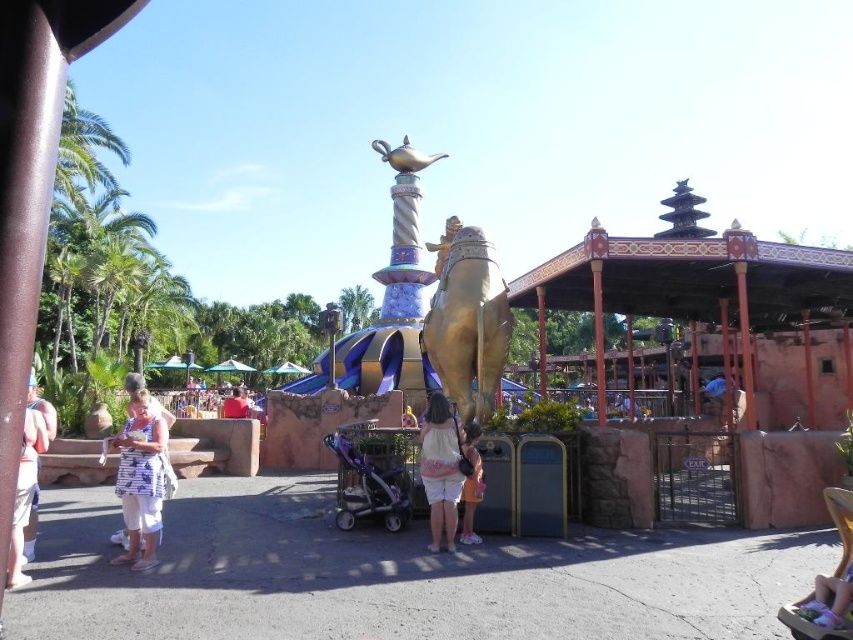
Question: Does metallic purple baby carriage at center have a larger size compared to white cotton dress at center?

Choices:
 (A) no
 (B) yes

Answer: (B)

Question: Which point appears farthest from the camera in this image?

Choices:
 (A) (15, 586)
 (B) (117, 435)
 (C) (437, 442)
 (D) (480, 480)

Answer: (B)

Question: Does white printed dress at lower left appear on the right side of white cotton shirt at center?

Choices:
 (A) no
 (B) yes

Answer: (A)

Question: Among these points, which one is nearest to the camera?

Choices:
 (A) (384, 451)
 (B) (473, 496)
 (C) (18, 497)

Answer: (C)

Question: Does white cotton shirt at center have a lesser width compared to white cotton dress at lower left?

Choices:
 (A) yes
 (B) no

Answer: (A)

Question: Which object is the farthest from the white cotton dress at center?

Choices:
 (A) white printed dress at lower left
 (B) white cotton dress at lower left
 (C) white cotton shirt at center
 (D) metallic purple baby carriage at center

Answer: (B)